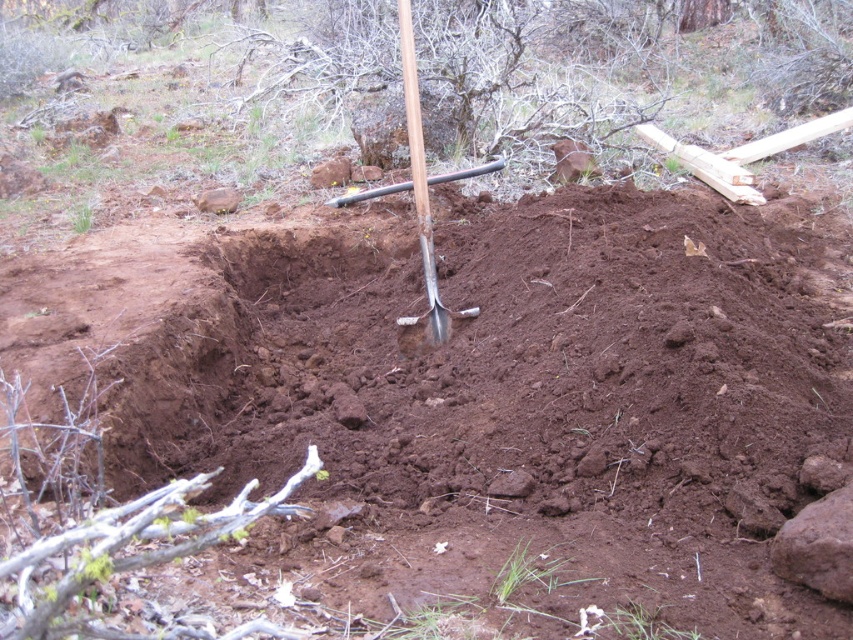
Who is more distant from viewer, [146,310] or [404,20]?

The point [404,20] is more distant.

Which of these two, brown soil at center or silver metallic shovel at center, stands taller?

Standing taller between the two is brown soil at center.

Describe the element at coordinates (485, 396) in the screenshot. This screenshot has width=853, height=640. I see `brown soil at center` at that location.

I want to click on brown soil at center, so click(x=485, y=396).